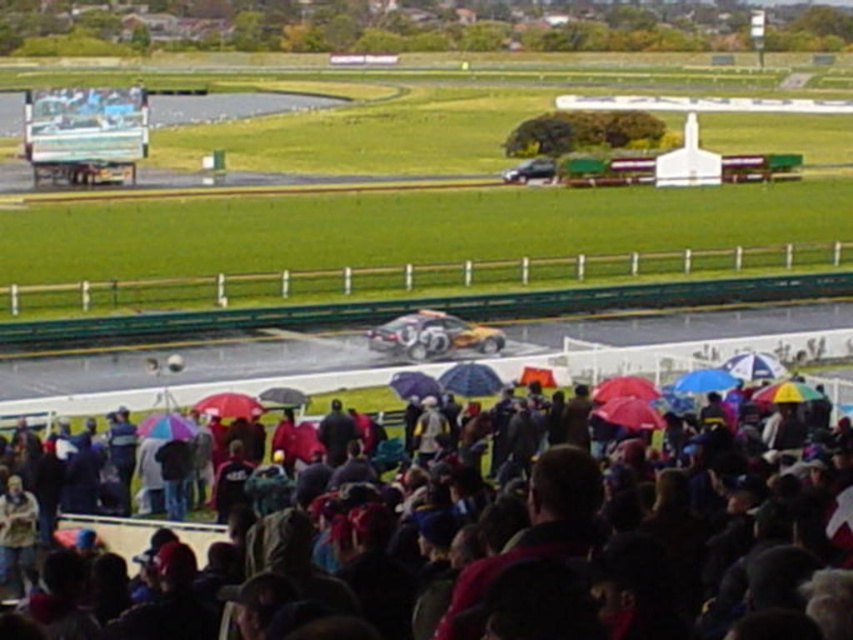
Question: Based on their relative distances, which object is farther from the rainbow fabric umbrella at center?

Choices:
 (A) denim jacket at lower left
 (B) red matte umbrella at lower center

Answer: (A)

Question: Is denim jacket at lower left bigger than rainbow fabric umbrella at center?

Choices:
 (A) no
 (B) yes

Answer: (B)

Question: Which object appears closest to the camera in this image?

Choices:
 (A) denim jacket at lower left
 (B) red matte umbrella at lower center

Answer: (A)

Question: Can you confirm if rainbow umbrellas at lower center is bigger than denim jacket at lower left?

Choices:
 (A) yes
 (B) no

Answer: (A)

Question: Is rainbow umbrellas at lower center further to the viewer compared to red matte umbrella at lower center?

Choices:
 (A) no
 (B) yes

Answer: (A)

Question: Estimate the real-world distances between objects in this image. Which object is farther from the red matte umbrella at lower center?

Choices:
 (A) denim jacket at lower left
 (B) rainbow umbrellas at lower center

Answer: (B)